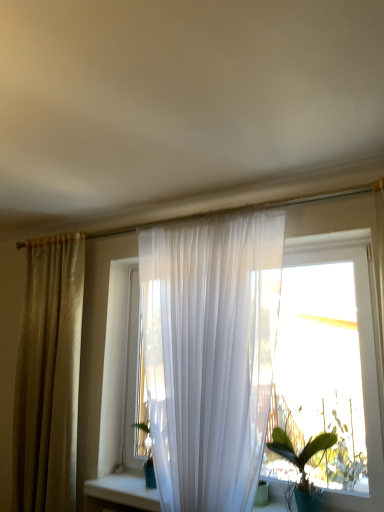
Question: Is translucent white curtain at center smaller than green glossy leafy plant at lower right?

Choices:
 (A) yes
 (B) no

Answer: (B)

Question: Would you say translucent white curtain at center is a long distance from green glossy leafy plant at lower right?

Choices:
 (A) yes
 (B) no

Answer: (A)

Question: Is translucent white curtain at center facing towards green glossy leafy plant at lower right?

Choices:
 (A) no
 (B) yes

Answer: (B)

Question: Does translucent white curtain at center have a greater width compared to green glossy leafy plant at lower right?

Choices:
 (A) yes
 (B) no

Answer: (B)

Question: Is translucent white curtain at center closer to camera compared to green glossy leafy plant at lower right?

Choices:
 (A) no
 (B) yes

Answer: (B)

Question: Considering the relative sizes of translucent white curtain at center and green glossy leafy plant at lower right in the image provided, is translucent white curtain at center taller than green glossy leafy plant at lower right?

Choices:
 (A) no
 (B) yes

Answer: (B)

Question: Is green glossy leafy plant at lower right oriented towards translucent white curtain at center?

Choices:
 (A) no
 (B) yes

Answer: (A)

Question: From the image's perspective, does green glossy leafy plant at lower right appear lower than translucent white curtain at center?

Choices:
 (A) yes
 (B) no

Answer: (A)

Question: Is green glossy leafy plant at lower right directly adjacent to translucent white curtain at center?

Choices:
 (A) no
 (B) yes

Answer: (A)

Question: From a real-world perspective, is green glossy leafy plant at lower right positioned over translucent white curtain at center based on gravity?

Choices:
 (A) no
 (B) yes

Answer: (A)

Question: From a real-world perspective, is green glossy leafy plant at lower right beneath translucent white curtain at center?

Choices:
 (A) yes
 (B) no

Answer: (A)

Question: Is green glossy leafy plant at lower right not inside translucent white curtain at center?

Choices:
 (A) yes
 (B) no

Answer: (A)

Question: Considering the relative sizes of green glossy leafy plant at lower right and matte beige curtain at left in the image provided, is green glossy leafy plant at lower right taller than matte beige curtain at left?

Choices:
 (A) yes
 (B) no

Answer: (B)